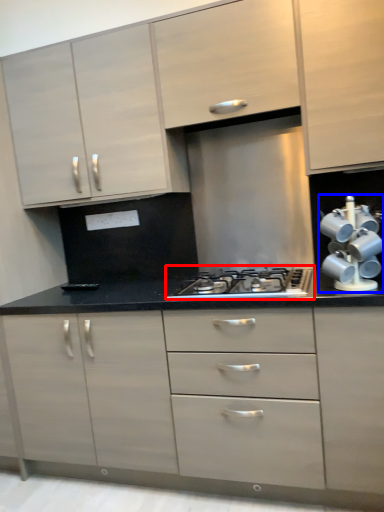
Question: Which object is further to the camera taking this photo, gas stove (highlighted by a red box) or appliance (highlighted by a blue box)?

Choices:
 (A) gas stove
 (B) appliance

Answer: (A)